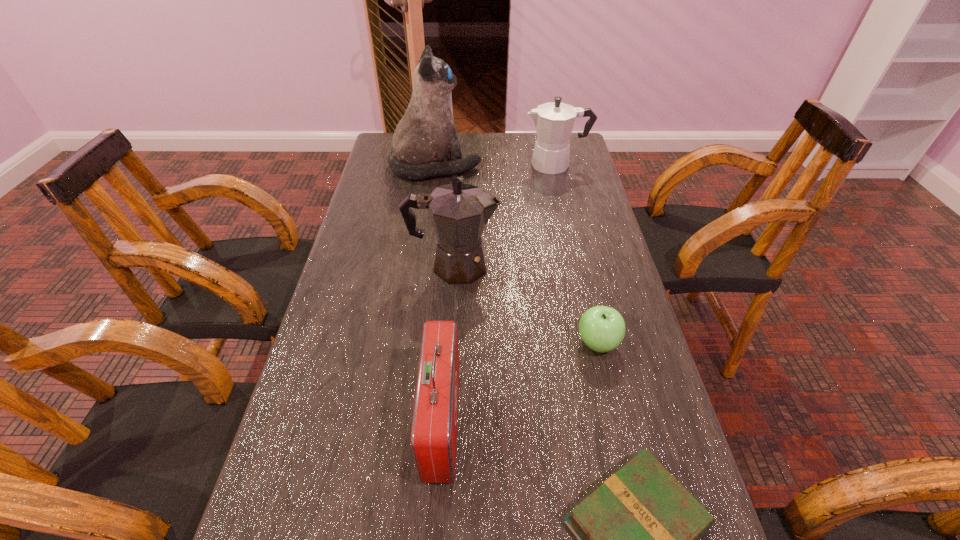
The width and height of the screenshot is (960, 540). I want to click on object that is the third nearest to the cat, so click(602, 328).

Locate an element on the screen. Image resolution: width=960 pixels, height=540 pixels. free location that satisfies the following two spatial constraints: 1. on the back side of the apple; 2. at the face of the tallest object is located at coordinates (557, 166).

Locate an element on the screen. free location that satisfies the following two spatial constraints: 1. at the spout of the apple; 2. on the right side of the right coffeepot is located at coordinates (597, 343).

Find the location of `vacant position in the image that satisfies the following two spatial constraints: 1. at the spout of the fourth farthest object; 2. on the right side of the farther coffeepot`. vacant position in the image that satisfies the following two spatial constraints: 1. at the spout of the fourth farthest object; 2. on the right side of the farther coffeepot is located at coordinates (597, 343).